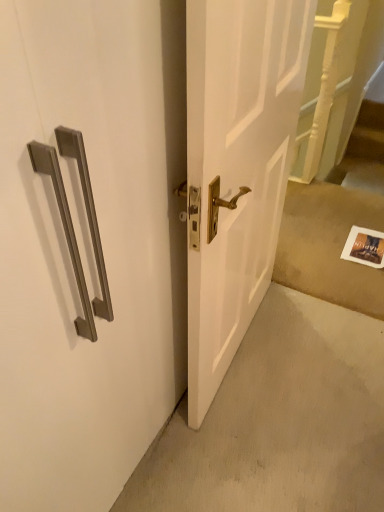
Question: Considering the relative positions of wooden staircase at right and satin nickel handle at upper left in the image provided, is wooden staircase at right to the right of satin nickel handle at upper left from the viewer's perspective?

Choices:
 (A) yes
 (B) no

Answer: (A)

Question: From the image's perspective, would you say wooden staircase at right is shown under satin nickel handle at upper left?

Choices:
 (A) no
 (B) yes

Answer: (A)

Question: From a real-world perspective, is wooden staircase at right located beneath satin nickel handle at upper left?

Choices:
 (A) yes
 (B) no

Answer: (A)

Question: Can you confirm if wooden staircase at right is taller than satin nickel handle at upper left?

Choices:
 (A) yes
 (B) no

Answer: (B)

Question: Is wooden staircase at right looking in the opposite direction of satin nickel handle at upper left?

Choices:
 (A) no
 (B) yes

Answer: (A)

Question: Looking at the image, does wooden staircase at right seem bigger or smaller compared to satin nickel handle at upper left?

Choices:
 (A) big
 (B) small

Answer: (B)

Question: Considering their positions, is wooden staircase at right located in front of or behind satin nickel handle at upper left?

Choices:
 (A) behind
 (B) front

Answer: (A)

Question: Considering the positions of point (360, 143) and point (142, 52), is point (360, 143) closer or farther from the camera than point (142, 52)?

Choices:
 (A) closer
 (B) farther

Answer: (B)

Question: Do you think wooden staircase at right is within satin nickel handle at upper left, or outside of it?

Choices:
 (A) inside
 (B) outside

Answer: (B)

Question: From a real-world perspective, is satin nickel handle at upper left above or below white paper at lower right?

Choices:
 (A) below
 (B) above

Answer: (B)

Question: From the image's perspective, is satin nickel handle at upper left positioned above or below white paper at lower right?

Choices:
 (A) above
 (B) below

Answer: (B)

Question: Is satin nickel handle at upper left bigger or smaller than white paper at lower right?

Choices:
 (A) big
 (B) small

Answer: (A)

Question: Does point (74, 396) appear closer or farther from the camera than point (339, 190)?

Choices:
 (A) farther
 (B) closer

Answer: (B)

Question: Considering the positions of white paper at lower right and wooden staircase at right in the image, is white paper at lower right taller or shorter than wooden staircase at right?

Choices:
 (A) tall
 (B) short

Answer: (B)

Question: From the image's perspective, is white paper at lower right positioned above or below wooden staircase at right?

Choices:
 (A) below
 (B) above

Answer: (A)